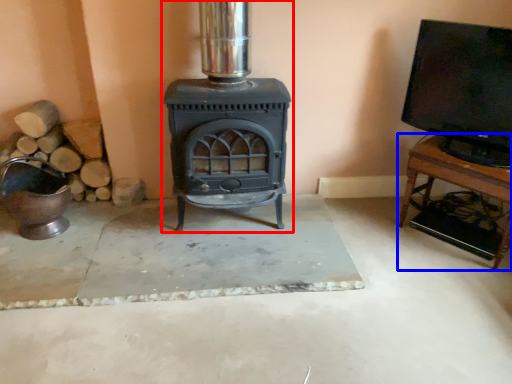
Question: Which of the following is the farthest to the observer, wood burning stove (highlighted by a red box) or furniture (highlighted by a blue box)?

Choices:
 (A) wood burning stove
 (B) furniture

Answer: (B)